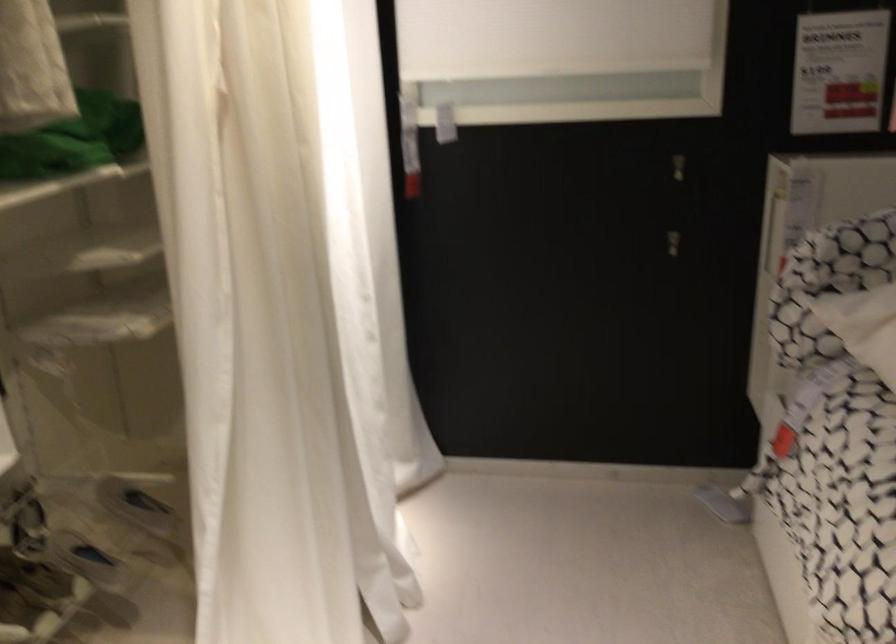
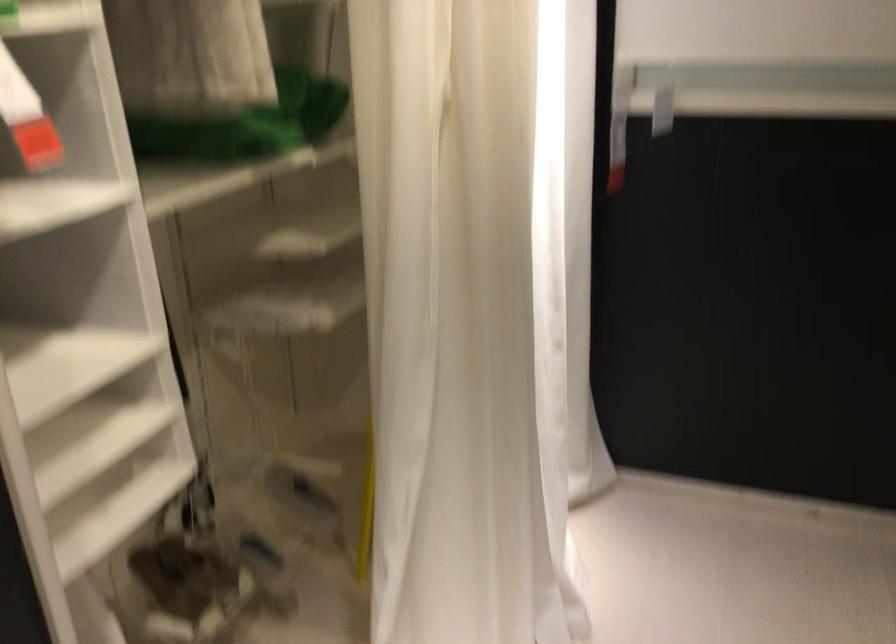
Question: How did the camera likely rotate?

Choices:
 (A) Left
 (B) Right
 (C) Up
 (D) Down

Answer: (A)